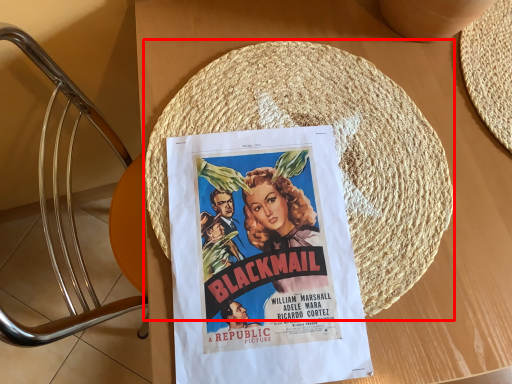
Question: From the image, what is the correct spatial relationship of straw hat (annotated by the red box) in relation to poster?

Choices:
 (A) left
 (B) right

Answer: (B)